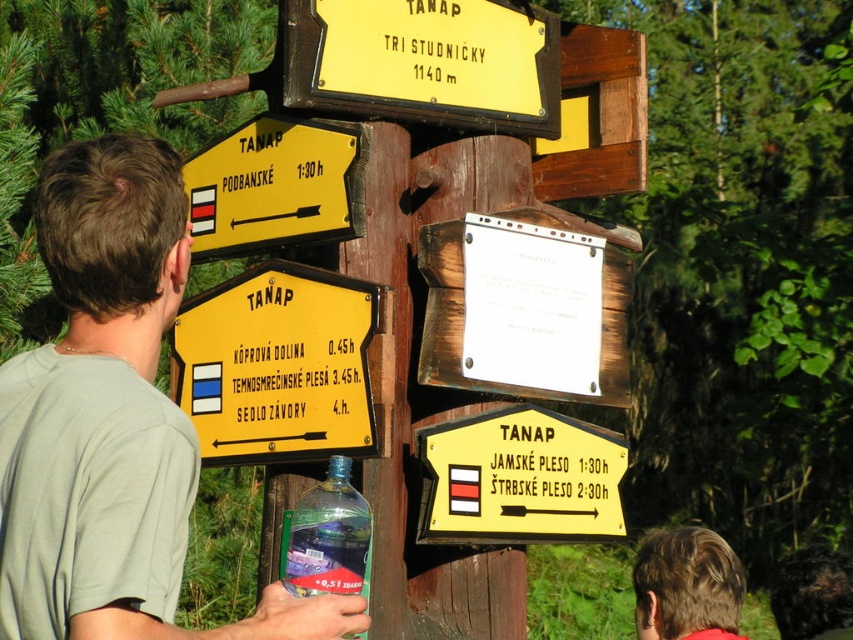
Does yellow matte signpost at center lie in front of yellow painted wood sign at center?

That is True.

Can you confirm if yellow matte signpost at center is wider than yellow painted wood sign at center?

Correct, the width of yellow matte signpost at center exceeds that of yellow painted wood sign at center.

Identify the location of yellow matte signpost at center. Image resolution: width=853 pixels, height=640 pixels. (283, 365).

Measure the distance from yellow matte signpost at center to blonde hair at upper right.

They are 4.37 meters apart.

The width and height of the screenshot is (853, 640). What are the coordinates of `yellow matte signpost at center` in the screenshot? It's located at click(283, 365).

Find the location of a particular element. This screenshot has width=853, height=640. yellow matte signpost at center is located at coordinates (283, 365).

Between yellow plastic sign at upper center and blonde hair at upper right, which one has less height?

Standing shorter between the two is yellow plastic sign at upper center.

Looking at this image, between yellow plastic sign at upper center and blonde hair at upper right, which one appears on the left side from the viewer's perspective?

Positioned to the left is yellow plastic sign at upper center.

The width and height of the screenshot is (853, 640). What do you see at coordinates (424, 61) in the screenshot?
I see `yellow plastic sign at upper center` at bounding box center [424, 61].

Find the location of `yellow plastic sign at upper center`. yellow plastic sign at upper center is located at coordinates coord(424,61).